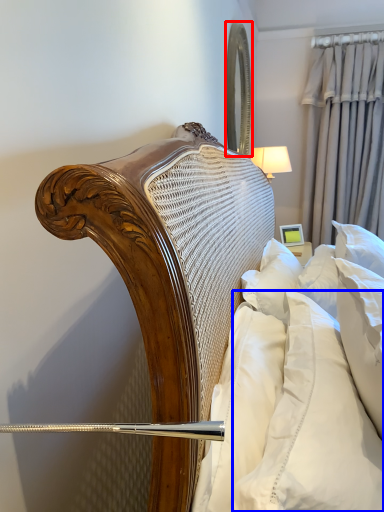
Question: Which of the following is the farthest to the observer, mirror (highlighted by a red box) or pillow (highlighted by a blue box)?

Choices:
 (A) mirror
 (B) pillow

Answer: (A)